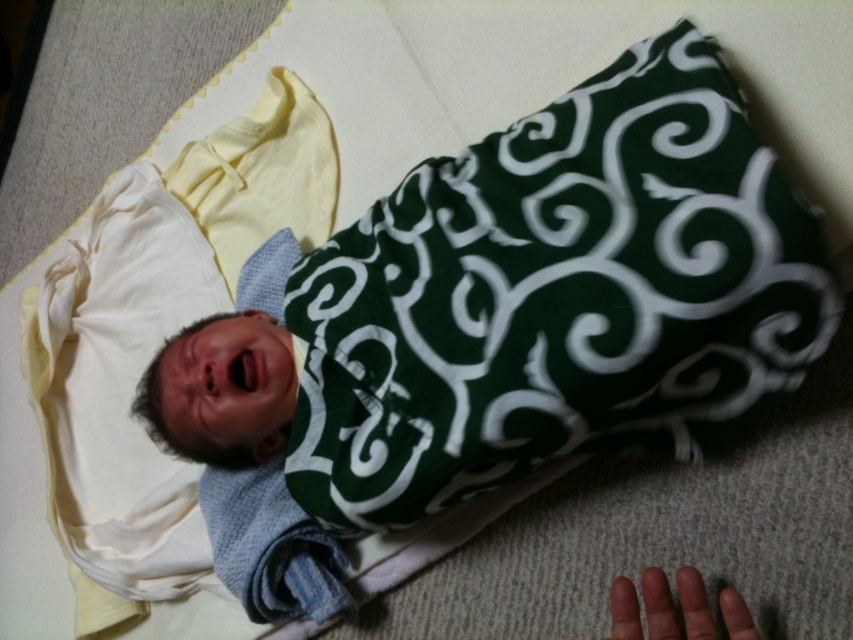
Is point (564, 227) closer to camera compared to point (730, 614)?

Yes, point (564, 227) is in front of point (730, 614).

What do you see at coordinates (556, 296) in the screenshot? Image resolution: width=853 pixels, height=640 pixels. I see `green fabric pillow at center` at bounding box center [556, 296].

At what (x,y) coordinates should I click in order to perform the action: click on green fabric pillow at center. Please return your answer as a coordinate pair (x, y). The image size is (853, 640). Looking at the image, I should click on (556, 296).